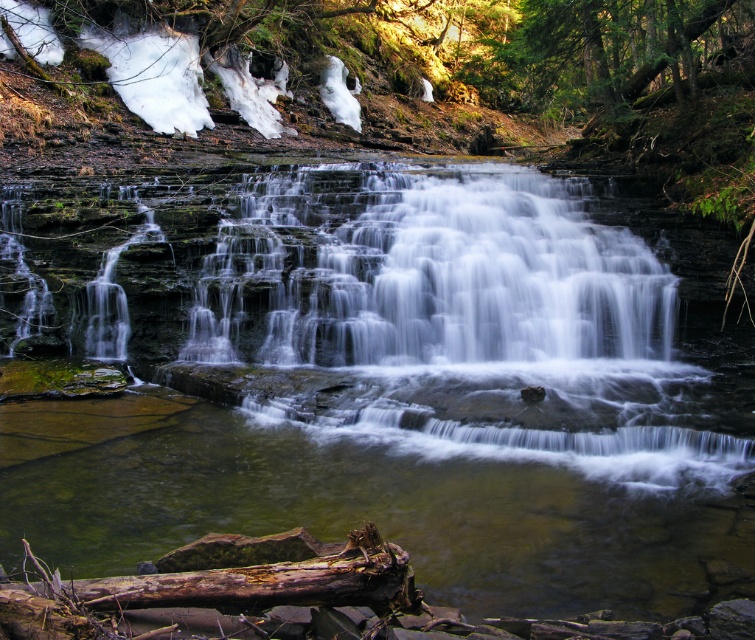
You are a photographer planning to capture the waterfall scene. You want to ensure your camera is positioned so that the clear water at center and rusty wood log at lower center are both in the frame. Based on their spatial relationship, which object should you prioritize framing first to ensure both are visible?

The clear water at center might be wider than rusty wood log at lower center, so you should prioritize framing the clear water at center first to ensure both objects are visible in the composition.

You are standing at the edge of the waterfall and want to cross to the other side. The clear water at center flows swiftly, and the rusty wood log at lower center is partially submerged. Considering the height difference between them, which object would be safer to step on to avoid getting wet?

The rusty wood log at lower center is safer to step on because it is shorter than the clear water at center, providing a higher elevation and reducing the chance of getting wet from the flowing water.

You are a photographer planning to capture the waterfall scene. You want to ensure your composition includes both the clear water at center and the rusty wood log at lower center. Which object will occupy more space in your photo?

The clear water at center occupies more space in the photo because it is bigger than the rusty wood log at lower center according to the description.